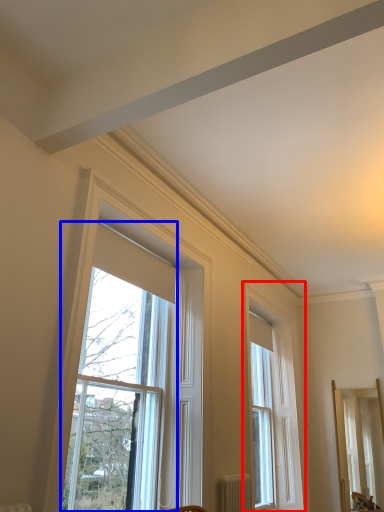
Question: Which object is further to the camera taking this photo, window (highlighted by a red box) or window (highlighted by a blue box)?

Choices:
 (A) window
 (B) window

Answer: (A)